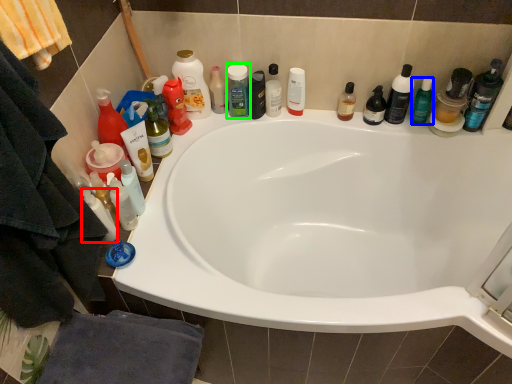
Question: Based on their relative distances, which object is farther from toiletry (highlighted by a red box)? Choose from toiletry (highlighted by a blue box) and toiletry (highlighted by a green box).

Choices:
 (A) toiletry
 (B) toiletry

Answer: (A)